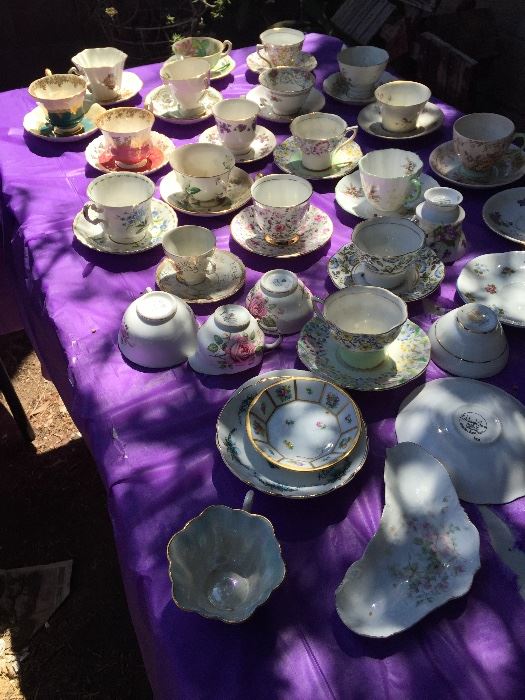
Identify the location of bowls with saucers. (369, 330), (392, 258), (309, 438).